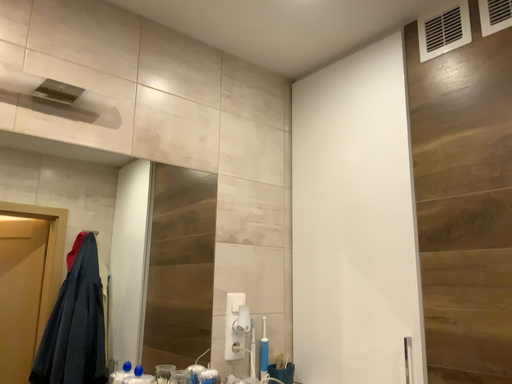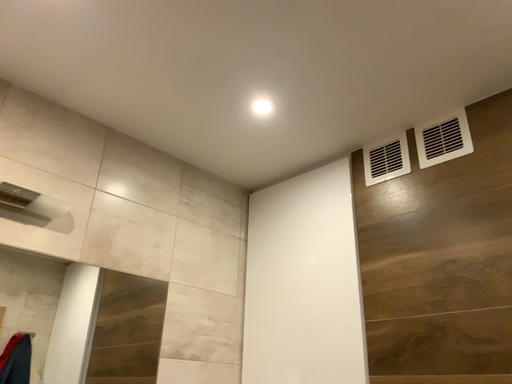
Question: How did the camera likely rotate when shooting the video?

Choices:
 (A) rotated downward
 (B) rotated upward

Answer: (B)